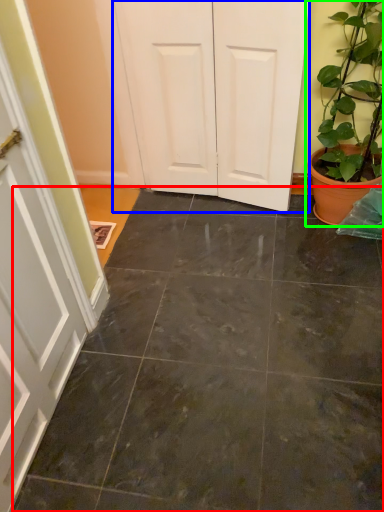
Question: Which object is positioned farthest from concrete (highlighted by a red box)? Select from door (highlighted by a blue box) and houseplant (highlighted by a green box).

Choices:
 (A) door
 (B) houseplant

Answer: (A)